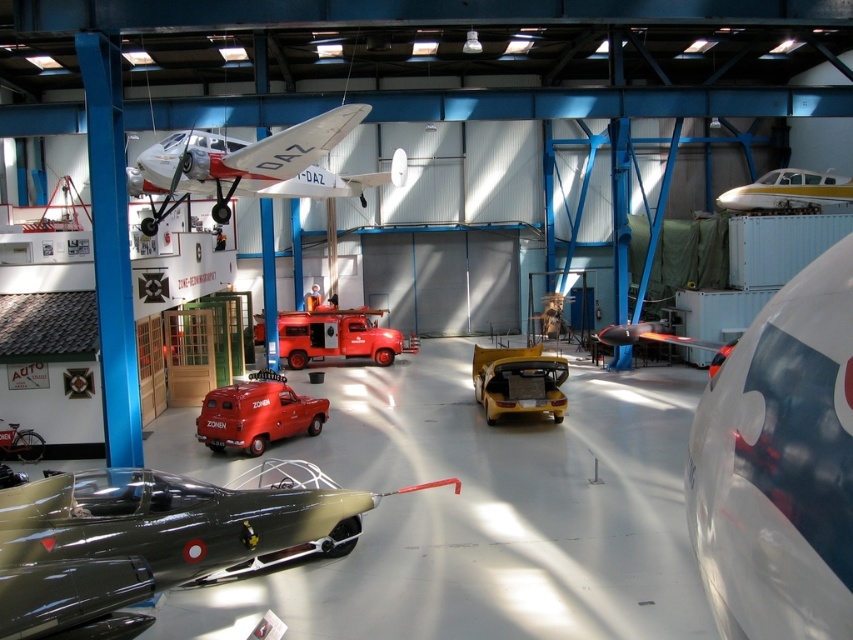
Question: In this image, where is white matte airplane at upper center located relative to matte red van at center?

Choices:
 (A) left
 (B) right

Answer: (B)

Question: Among these points, which one is nearest to the camera?

Choices:
 (A) (480, 401)
 (B) (306, 349)
 (C) (848, 195)
 (D) (735, 611)

Answer: (D)

Question: Considering the real-world distances, which object is closest to the shiny red fire truck at center?

Choices:
 (A) yellow/golden metallic airplane at upper right
 (B) white matte airplane at upper center
 (C) matte red van at center
 (D) metallic olive green car at lower left

Answer: (C)

Question: Which of the following is the closest to the observer?

Choices:
 (A) shiny red fire truck at center
 (B) metallic olive green car at lower left
 (C) yellow matte car at center

Answer: (B)

Question: Can you confirm if shiny silver airplane at center is wider than yellow matte car at center?

Choices:
 (A) no
 (B) yes

Answer: (A)

Question: In this image, where is shiny red fire truck at center located relative to yellow/golden metallic airplane at upper right?

Choices:
 (A) left
 (B) right

Answer: (A)